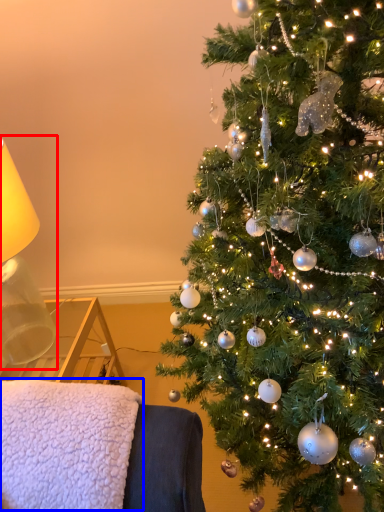
Question: Which object appears closest to the camera in this image, table lamp (highlighted by a red box) or blanket (highlighted by a blue box)?

Choices:
 (A) table lamp
 (B) blanket

Answer: (B)